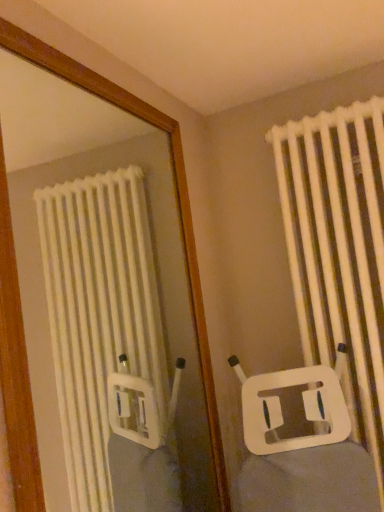
Question: Considering the relative sizes of white plastic mirror at upper center and white plastic radiator at right in the image provided, is white plastic mirror at upper center taller than white plastic radiator at right?

Choices:
 (A) no
 (B) yes

Answer: (A)

Question: Can you confirm if white plastic mirror at upper center is thinner than white plastic radiator at right?

Choices:
 (A) no
 (B) yes

Answer: (B)

Question: From the image's perspective, is white plastic mirror at upper center above white plastic radiator at right?

Choices:
 (A) yes
 (B) no

Answer: (B)

Question: Is white plastic mirror at upper center positioned with its back to white plastic radiator at right?

Choices:
 (A) no
 (B) yes

Answer: (A)

Question: Is the surface of white plastic mirror at upper center in direct contact with white plastic radiator at right?

Choices:
 (A) yes
 (B) no

Answer: (B)

Question: Is white plastic mirror at upper center shorter than white plastic radiator at right?

Choices:
 (A) no
 (B) yes

Answer: (B)

Question: From a real-world perspective, is white plastic radiator at right under white plastic mirror at upper center?

Choices:
 (A) yes
 (B) no

Answer: (A)

Question: Are white plastic radiator at right and white plastic mirror at upper center far apart?

Choices:
 (A) yes
 (B) no

Answer: (B)

Question: Considering the relative sizes of white plastic radiator at right and white plastic mirror at upper center in the image provided, is white plastic radiator at right shorter than white plastic mirror at upper center?

Choices:
 (A) yes
 (B) no

Answer: (B)

Question: Does white plastic radiator at right have a lesser width compared to white plastic mirror at upper center?

Choices:
 (A) yes
 (B) no

Answer: (B)

Question: From the image's perspective, is white plastic radiator at right above white plastic mirror at upper center?

Choices:
 (A) yes
 (B) no

Answer: (A)

Question: Is white plastic radiator at right not within white plastic mirror at upper center?

Choices:
 (A) no
 (B) yes

Answer: (B)

Question: Is white plastic mirror at upper center wider or thinner than white plastic radiator at right?

Choices:
 (A) wide
 (B) thin

Answer: (B)